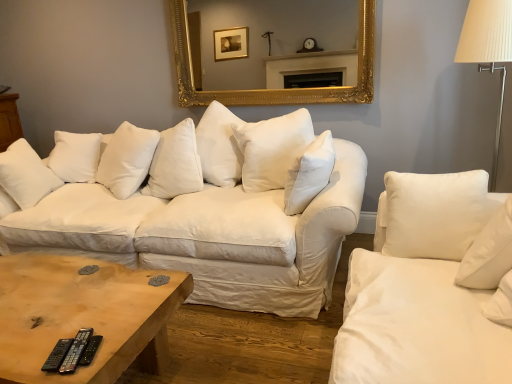
At what (x,y) coordinates should I click in order to perform the action: click on unoccupied area in front of black plastic remote at lower left, which ranks as the 2th remote in left-to-right order. Please return your answer as a coordinate pair (x, y). Looking at the image, I should click on (78, 369).